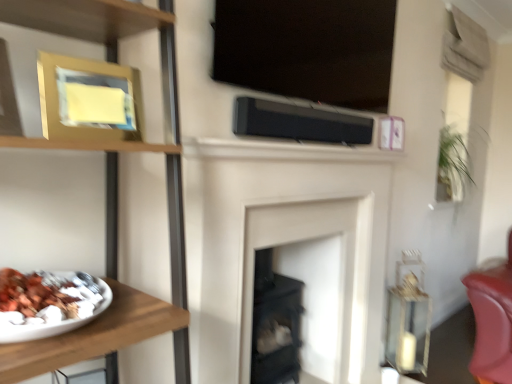
In order to face wooden plate at left, should I rotate leftwards or rightwards?

Turn left by 22.304 degrees to look at wooden plate at left.

Locate an element on the screen. The width and height of the screenshot is (512, 384). white matte plate at left is located at coordinates (94, 335).

This screenshot has height=384, width=512. What do you see at coordinates (316, 275) in the screenshot?
I see `white matte fireplace at center` at bounding box center [316, 275].

This screenshot has height=384, width=512. I want to click on wooden plate at left, so click(116, 62).

Is gold metallic picture frame at upper left at the right side of black matte speaker at center?

Incorrect, gold metallic picture frame at upper left is not on the right side of black matte speaker at center.

Considering the relative sizes of gold metallic picture frame at upper left and black matte speaker at center in the image provided, is gold metallic picture frame at upper left smaller than black matte speaker at center?

Correct, gold metallic picture frame at upper left occupies less space than black matte speaker at center.

Is gold metallic picture frame at upper left thinner than black matte speaker at center?

No.

Considering the positions of points (74, 137) and (258, 101), is point (74, 137) closer to camera compared to point (258, 101)?

Yes, it is.

Is white matte fireplace at center oriented away from wooden plate at left?

white matte fireplace at center does not have its back to wooden plate at left.

From a real-world perspective, which is physically above, white matte fireplace at center or wooden plate at left?

wooden plate at left is physically above.

Does point (328, 264) lie behind point (116, 276)?

Yes, it is behind point (116, 276).

Which of these two, white matte fireplace at center or wooden plate at left, is bigger?

wooden plate at left is bigger.

Is wooden plate at left at the left side of gold metallic picture frame at upper left?

No.

Considering the relative sizes of wooden plate at left and gold metallic picture frame at upper left in the image provided, is wooden plate at left taller than gold metallic picture frame at upper left?

Yes.

You are a GUI agent. You are given a task and a screenshot of the screen. Output one action in this format:
    pyautogui.click(x=<x>, y=<y>)
    Task: Click on the picture frame behind the wooden plate at left
    This screenshot has width=512, height=384.
    Given the screenshot: What is the action you would take?
    pyautogui.click(x=84, y=95)

Is wooden plate at left in front of or behind gold metallic picture frame at upper left in the image?

Visually, wooden plate at left is located in front of gold metallic picture frame at upper left.

Is gold metallic picture frame at upper left oriented towards white matte fireplace at center?

No.

Is white matte fireplace at center inside gold metallic picture frame at upper left?

No, white matte fireplace at center is not a part of gold metallic picture frame at upper left.

Which is more to the right, gold metallic picture frame at upper left or white matte fireplace at center?

Positioned to the right is white matte fireplace at center.

From a real-world perspective, is white matte fireplace at center physically located above or below black matte speaker at center?

From a real-world perspective, white matte fireplace at center is physically below black matte speaker at center.

Which is in front, point (339, 301) or point (234, 105)?

Point (234, 105)

Considering the sizes of white matte fireplace at center and black matte speaker at center in the image, is white matte fireplace at center bigger or smaller than black matte speaker at center?

Clearly, white matte fireplace at center is larger in size than black matte speaker at center.

Would you say black matte speaker at center is part of white matte fireplace at center's contents?

No.

Is black matte speaker at center bigger than white matte plate at left?

Yes, black matte speaker at center is bigger than white matte plate at left.

Find the location of `furniture that appears on the left of black matte speaker at center`. furniture that appears on the left of black matte speaker at center is located at coordinates (94, 335).

Is black matte speaker at center taller or shorter than white matte plate at left?

Considering their sizes, black matte speaker at center has more height than white matte plate at left.

Is white matte fireplace at center oriented away from gold metallic picture frame at upper left?

No, white matte fireplace at center is not facing the opposite direction of gold metallic picture frame at upper left.

Consider the image. Does white matte fireplace at center appear on the left side of gold metallic picture frame at upper left?

No, white matte fireplace at center is not to the left of gold metallic picture frame at upper left.

Locate an element on the screen. The height and width of the screenshot is (384, 512). picture frame below the black matte speaker at center (from a real-world perspective) is located at coordinates (84, 95).

What are the coordinates of `fireplace on the right of the wooden plate at left` in the screenshot? It's located at (316, 275).

When comparing their distances from wooden plate at left, does black matte speaker at center or gold metallic picture frame at upper left seem closer?

gold metallic picture frame at upper left is closer to wooden plate at left.

Based on the photo, estimate the real-world distances between objects in this image. Which object is closer to white matte plate at left, black matte speaker at center or wooden plate at left?

wooden plate at left.

Looking at the image, which one is located closer to white matte fireplace at center, black matte speaker at center or white matte plate at left?

black matte speaker at center is positioned closer to the anchor white matte fireplace at center.

Consider the image. Based on their spatial positions, is gold metallic picture frame at upper left or black matte speaker at center closer to white matte plate at left?

gold metallic picture frame at upper left is closer to white matte plate at left.

Based on their spatial positions, is white matte plate at left or gold metallic picture frame at upper left closer to wooden plate at left?

The object closer to wooden plate at left is gold metallic picture frame at upper left.

Estimate the real-world distances between objects in this image. Which object is closer to wooden plate at left, white matte plate at left or white matte fireplace at center?

white matte plate at left.

Considering their positions, is wooden plate at left positioned further to black matte speaker at center than gold metallic picture frame at upper left?

Among the two, wooden plate at left is located further to black matte speaker at center.

When comparing their distances from white matte fireplace at center, does wooden plate at left or gold metallic picture frame at upper left seem closer?

gold metallic picture frame at upper left lies closer to white matte fireplace at center than the other object.

Locate an element on the screen. This screenshot has width=512, height=384. picture frame situated between white matte plate at left and white matte fireplace at center from left to right is located at coordinates (84, 95).

Locate an element on the screen. The width and height of the screenshot is (512, 384). shelf between gold metallic picture frame at upper left and white matte plate at left in the vertical direction is located at coordinates (116, 62).

The height and width of the screenshot is (384, 512). I want to click on picture frame between black matte speaker at center and white matte fireplace at center vertically, so click(x=84, y=95).

Where is `picture frame located between white matte plate at left and black matte speaker at center in the depth direction`? picture frame located between white matte plate at left and black matte speaker at center in the depth direction is located at coordinates (84, 95).